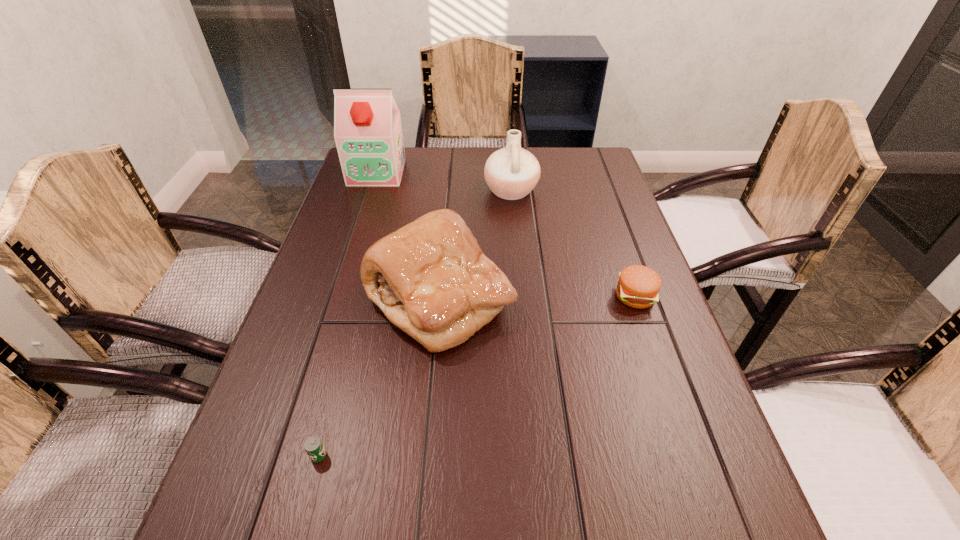
This screenshot has height=540, width=960. I want to click on vacant area between the tallest object and the hamburger, so click(x=506, y=234).

You are a GUI agent. You are given a task and a screenshot of the screen. Output one action in this format:
    pyautogui.click(x=<x>, y=<y>)
    Task: Click on the vacant space that is in between the fourth tallest object and the bread
    The image size is (960, 540).
    Given the screenshot: What is the action you would take?
    pyautogui.click(x=538, y=298)

Identify the location of object that can be found as the third closest to the second shortest object. (314, 447).

You are a GUI agent. You are given a task and a screenshot of the screen. Output one action in this format:
    pyautogui.click(x=<x>, y=<y>)
    Task: Click on the object that is the second closest to the second shortest object
    
    Given the screenshot: What is the action you would take?
    pyautogui.click(x=511, y=173)

This screenshot has width=960, height=540. Identify the location of free point that satisfies the following two spatial constraints: 1. with the cap open on the hamburger; 2. on the left side of the soya milk. (337, 296).

Locate an element on the screen. The image size is (960, 540). vacant space that satisfies the following two spatial constraints: 1. with the cap open on the beer can; 2. on the right side of the soya milk is located at coordinates (286, 455).

This screenshot has width=960, height=540. What are the coordinates of `vacant area that satisfies the following two spatial constraints: 1. to pour from the handle of the pottery; 2. on the front side of the nearest object` in the screenshot? It's located at (536, 455).

Where is `free space that satisfies the following two spatial constraints: 1. with the cap open on the tallest object; 2. on the left side of the nearest object`? This screenshot has width=960, height=540. free space that satisfies the following two spatial constraints: 1. with the cap open on the tallest object; 2. on the left side of the nearest object is located at coordinates (286, 455).